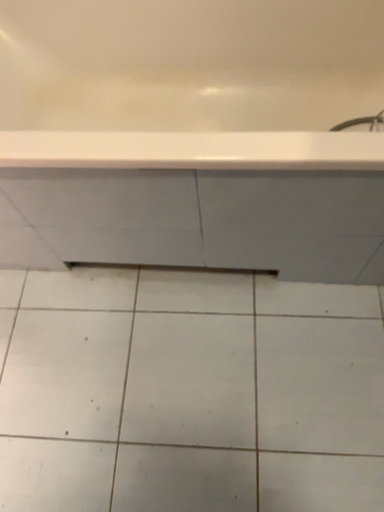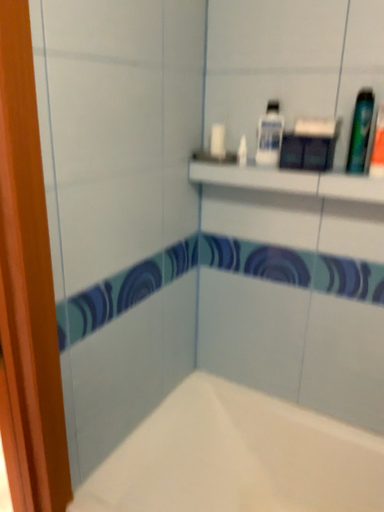
Question: Which way did the camera rotate in the video?

Choices:
 (A) rotated downward
 (B) rotated upward

Answer: (B)